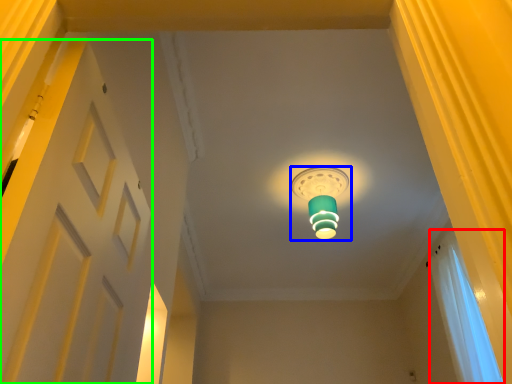
Question: Based on their relative distances, which object is nearer to curtain (highlighted by a red box)? Choose from lamp (highlighted by a blue box) and door (highlighted by a green box).

Choices:
 (A) lamp
 (B) door

Answer: (A)